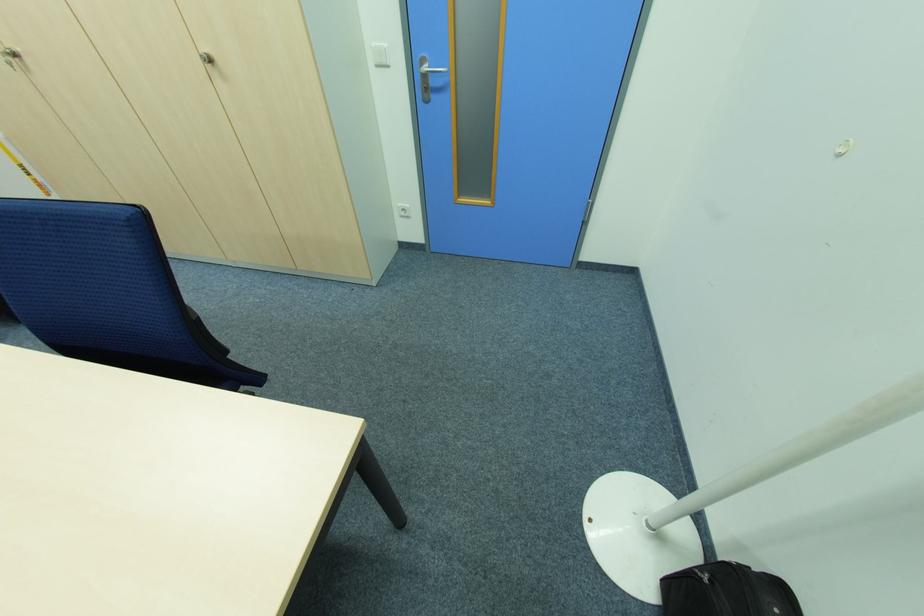
Find where to plugg the white electrical outlet. Please return your answer as a coordinate pair (x, y).

(403, 209)